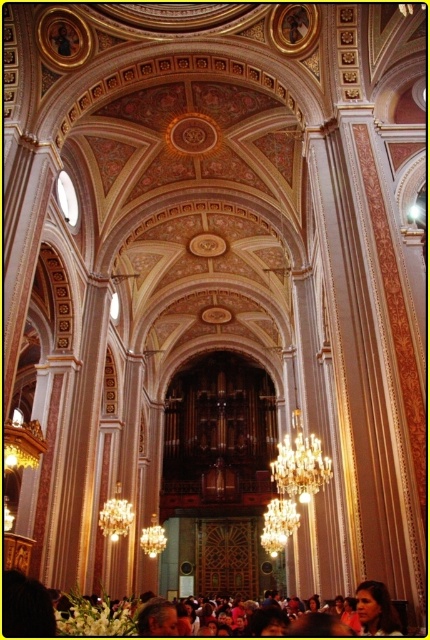
Question: Does gold crystal chandelier at center have a lesser width compared to smooth skin face at lower right?

Choices:
 (A) no
 (B) yes

Answer: (A)

Question: Which object appears farthest from the camera in this image?

Choices:
 (A) smooth skin face at lower right
 (B) gold crystal chandelier at center

Answer: (B)

Question: Can you confirm if gold crystal chandelier at center is thinner than smooth skin face at lower right?

Choices:
 (A) yes
 (B) no

Answer: (B)

Question: Which object appears closest to the camera in this image?

Choices:
 (A) gold crystal chandelier at center
 (B) smooth skin face at lower right

Answer: (B)

Question: Does gold crystal chandelier at center appear on the right side of smooth skin face at lower right?

Choices:
 (A) yes
 (B) no

Answer: (A)